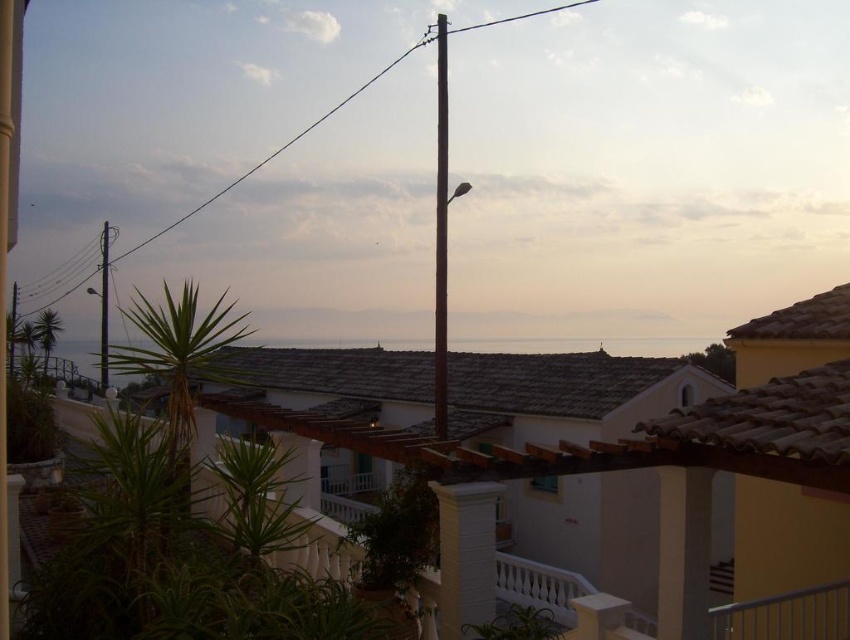
Question: Can you confirm if wooden pergola at center is bigger than brown wooden pole at center?

Choices:
 (A) no
 (B) yes

Answer: (A)

Question: Which of the following is the closest to the observer?

Choices:
 (A) (106, 291)
 (B) (349, 100)

Answer: (A)

Question: Among these objects, which one is farthest from the camera?

Choices:
 (A) metallic pole at upper center
 (B) gray stone water at center
 (C) brown wooden pole at center

Answer: (B)

Question: Which object appears closest to the camera in this image?

Choices:
 (A) gray stone water at center
 (B) metallic pole at upper center
 (C) black metal pole at center

Answer: (B)

Question: Is black metal pole at center wider than metallic pole at upper center?

Choices:
 (A) no
 (B) yes

Answer: (A)

Question: Where is gray stone water at center located in relation to metallic pole at upper center in the image?

Choices:
 (A) below
 (B) above

Answer: (A)